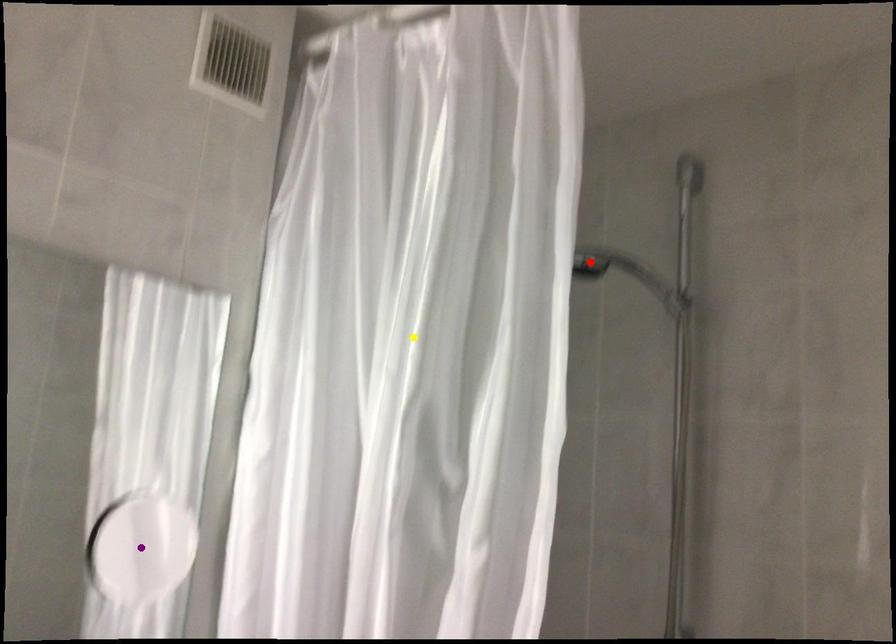
Order these from nearest to farthest:
red point, purple point, yellow point

1. yellow point
2. red point
3. purple point